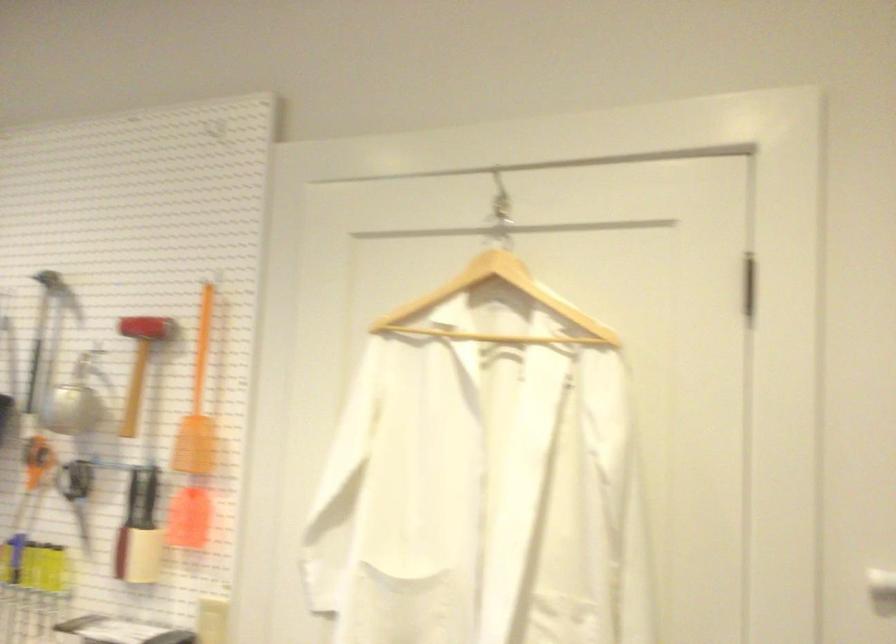
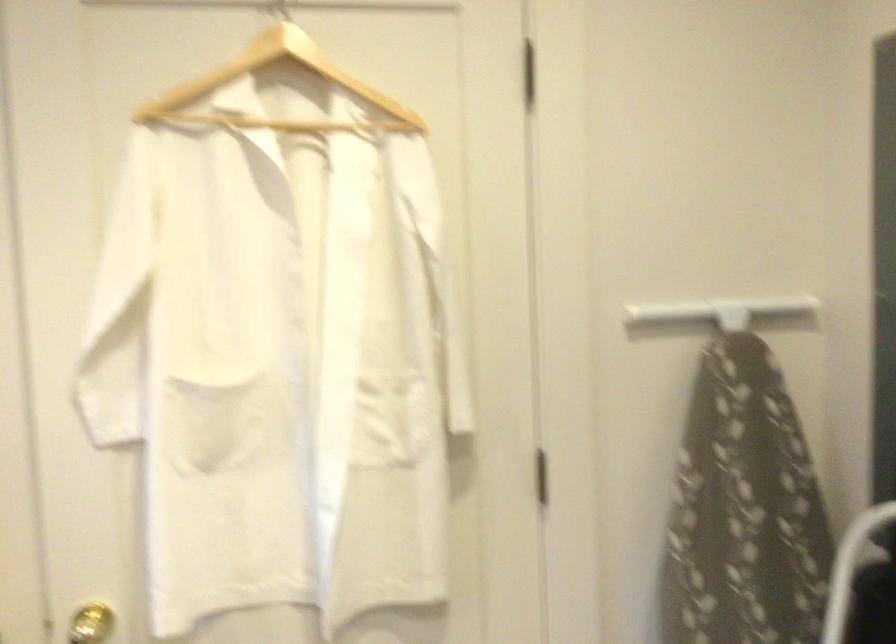
Question: The camera is either moving clockwise (left) or counter-clockwise (right) around the object. The first image is from the beginning of the video and the second image is from the end. Is the camera moving left or right when shooting the video?

Choices:
 (A) Left
 (B) Right

Answer: (A)